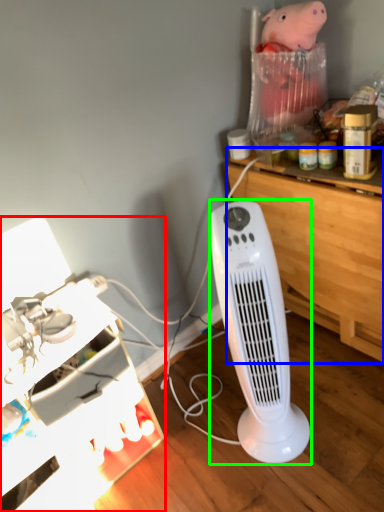
Question: Which is nearer to the furniture (highlighted by a red box)? computer desk (highlighted by a blue box) or home appliance (highlighted by a green box).

Choices:
 (A) computer desk
 (B) home appliance

Answer: (B)